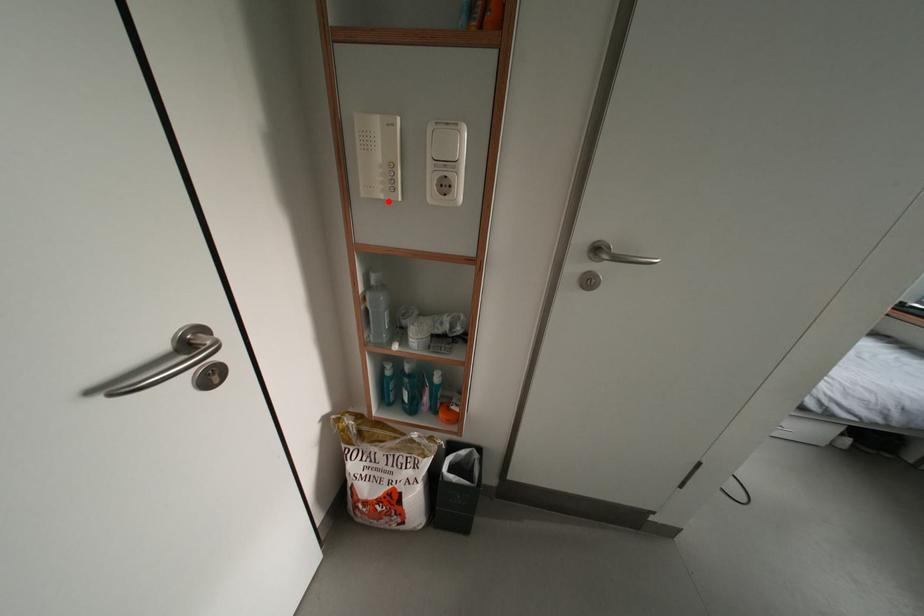
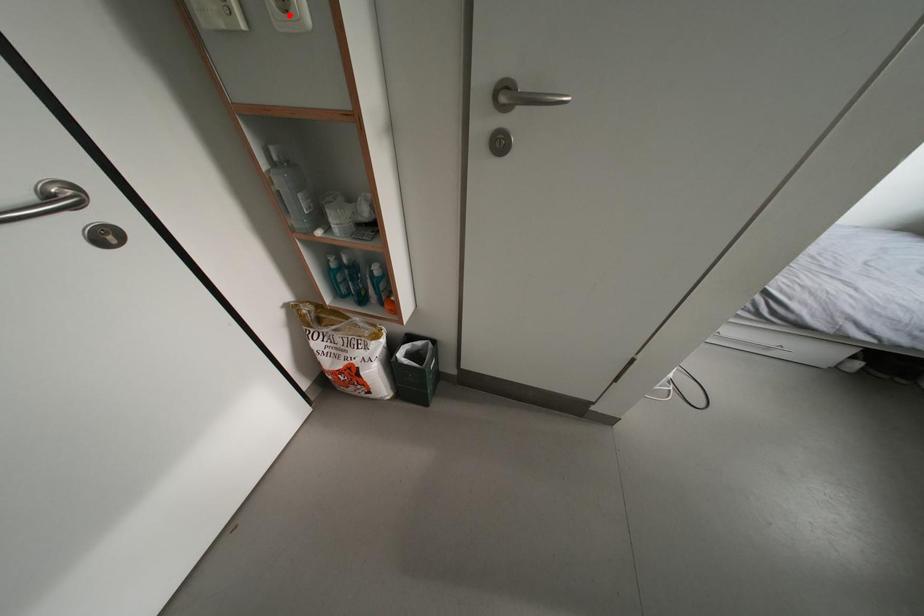
I am providing you with two images of the same scene from different viewpoints. A red point is marked on the first image and another point is marked on the second image. Do the highlighted points in image1 and image2 indicate the same real-world spot?

No